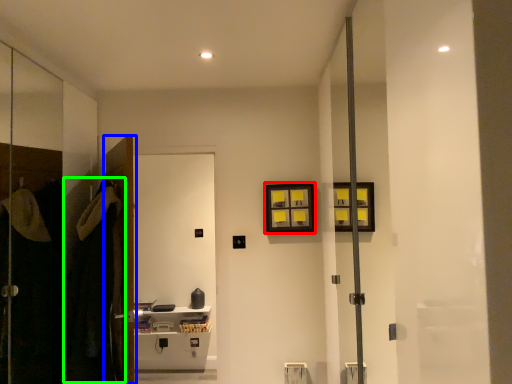
Question: Which object is the farthest from picture frame (highlighted by a red box)? Choose among these: door (highlighted by a blue box) or robe (highlighted by a green box).

Choices:
 (A) door
 (B) robe

Answer: (B)